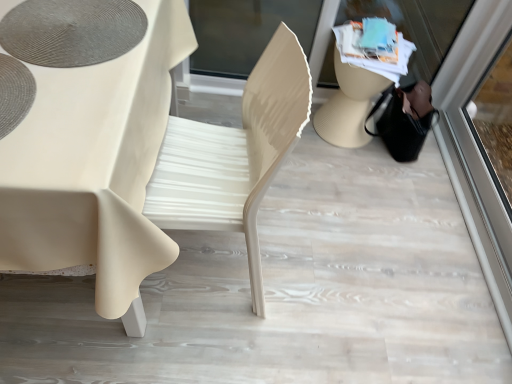
Question: Is transparent glass shop window at upper right in front of or behind matte gray placemat at upper left in the image?

Choices:
 (A) front
 (B) behind

Answer: (B)

Question: Is transparent glass shop window at upper right bigger or smaller than matte gray placemat at upper left?

Choices:
 (A) small
 (B) big

Answer: (B)

Question: Which object is positioned closest to the transparent glass screen door at right?

Choices:
 (A) transparent glass shop window at upper right
 (B) matte gray placemat at upper left
 (C) matte beige chair at center
 (D) matte white table at center

Answer: (A)

Question: Which is nearer to the matte beige chair at center?

Choices:
 (A) transparent glass screen door at right
 (B) matte white table at center
 (C) transparent glass shop window at upper right
 (D) matte gray placemat at upper left

Answer: (B)